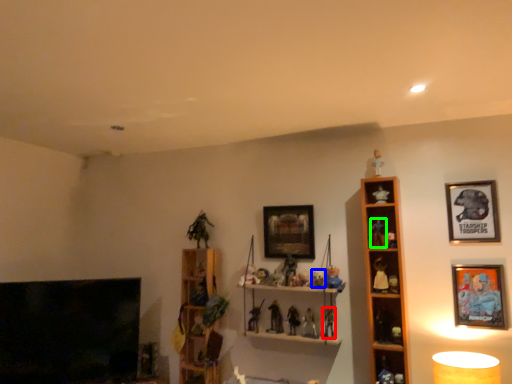
Question: Based on their relative distances, which object is nearer to toy (highlighted by a red box)? Choose from toy (highlighted by a blue box) and toy (highlighted by a green box).

Choices:
 (A) toy
 (B) toy

Answer: (A)